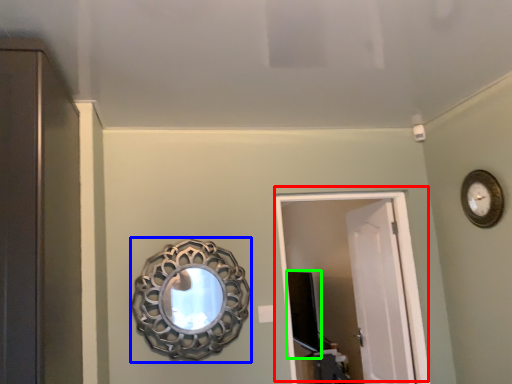
Question: Which object is the closest to the door (highlighted by a red box)? Choose among these: mirror (highlighted by a blue box) or medicine cabinet (highlighted by a green box).

Choices:
 (A) mirror
 (B) medicine cabinet

Answer: (B)